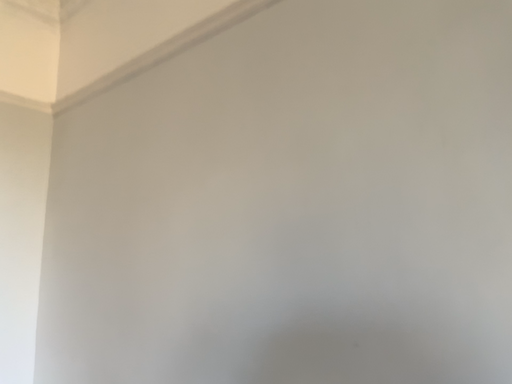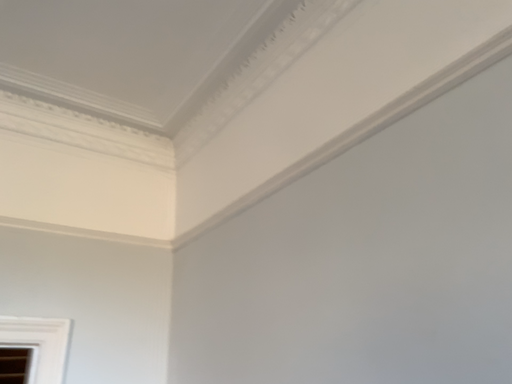
Question: Which way did the camera rotate in the video?

Choices:
 (A) rotated left
 (B) rotated right

Answer: (A)